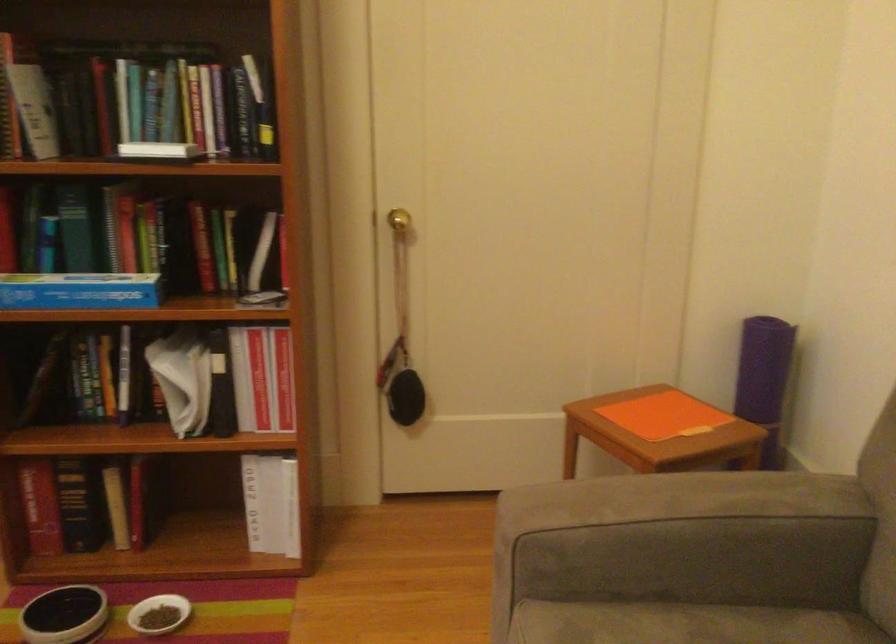
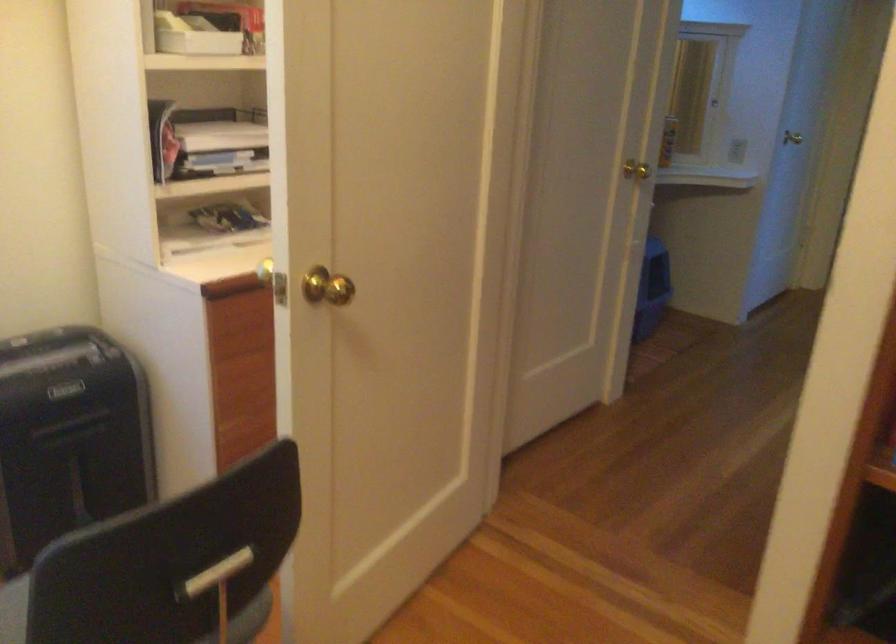
Question: The first image is from the beginning of the video and the second image is from the end. How did the camera likely rotate when shooting the video?

Choices:
 (A) Left
 (B) Right
 (C) Up
 (D) Down

Answer: (A)